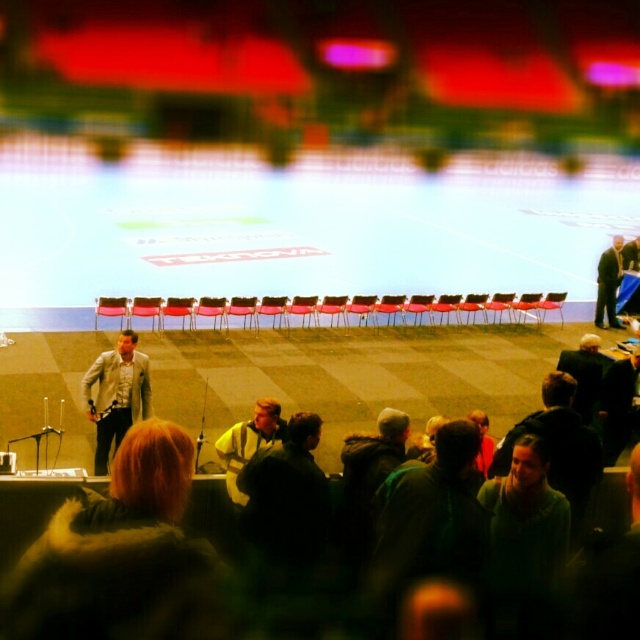
You are organizing a photo shoot and need to place a mannequin wearing the light gray textured blazer at center and the dark gray jacket at right. Which garment requires a larger mannequin?

The light gray textured blazer at center requires a larger mannequin since it has a larger size compared to the dark gray jacket at right.

You are an event organizer and need to place a new speaker podium at the center of the stage. However, there is an object already present at point [116,394]. What object is blocking the center of the stage?

The light gray textured blazer at center is located at point [116,394], which is blocking the center of the stage.

Looking at this image, you are an event organizer and need to arrange two coats on a coat rack. The light gray textured blazer at center and the dark gray jacket at right are both available. Which coat should you choose if you want to place it above the other one on the rack?

The light gray textured blazer at center has a greater height compared to the dark gray jacket at right, so it should be placed above the other one on the rack to accommodate its taller size.